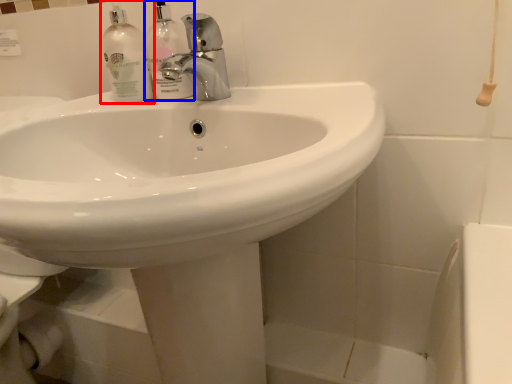
Question: Which of the following is the closest to the observer, cleaning product (highlighted by a red box) or cleaning product (highlighted by a blue box)?

Choices:
 (A) cleaning product
 (B) cleaning product

Answer: (B)